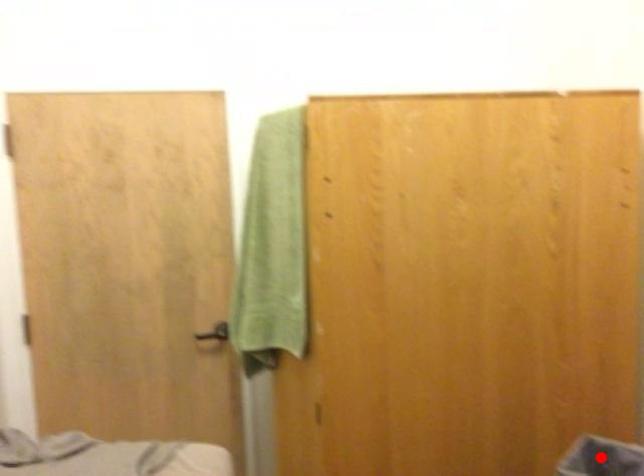
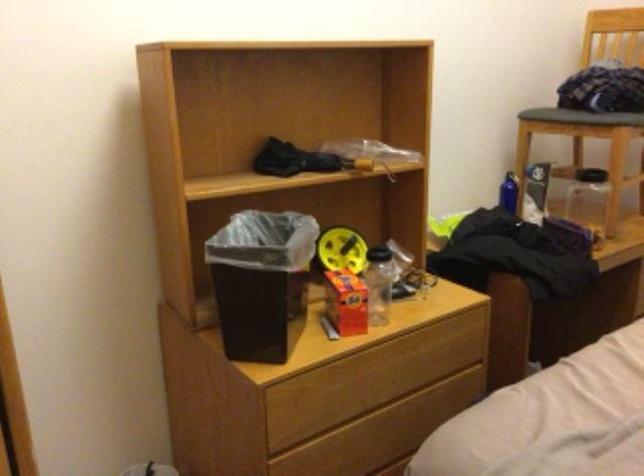
Question: I am providing you with two images of the same scene from different viewpoints. A red point is marked on the first image. Is the red point's position out of view in image 2?

Choices:
 (A) Yes
 (B) No

Answer: (A)